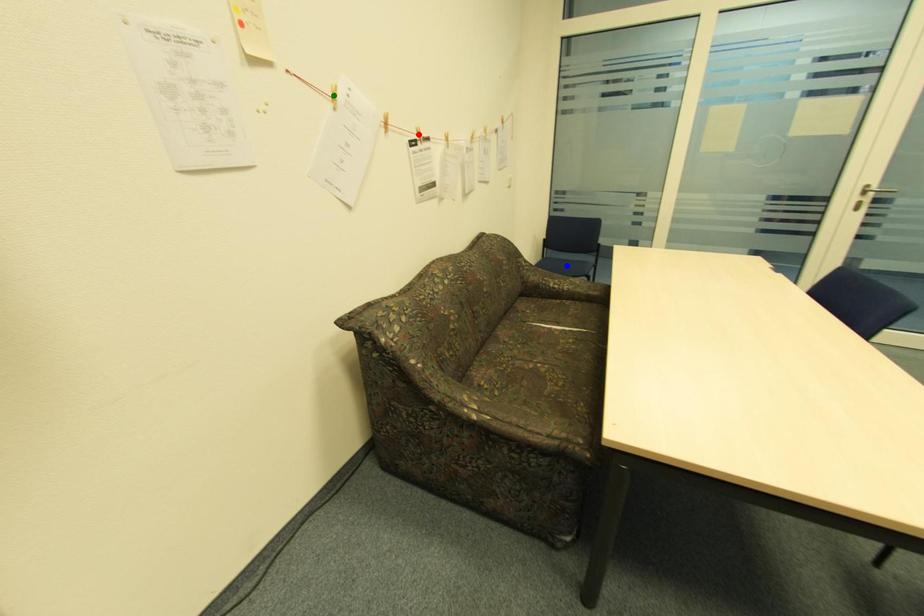
Order these from farthest to nearest:
blue point
green point
red point

blue point → red point → green point